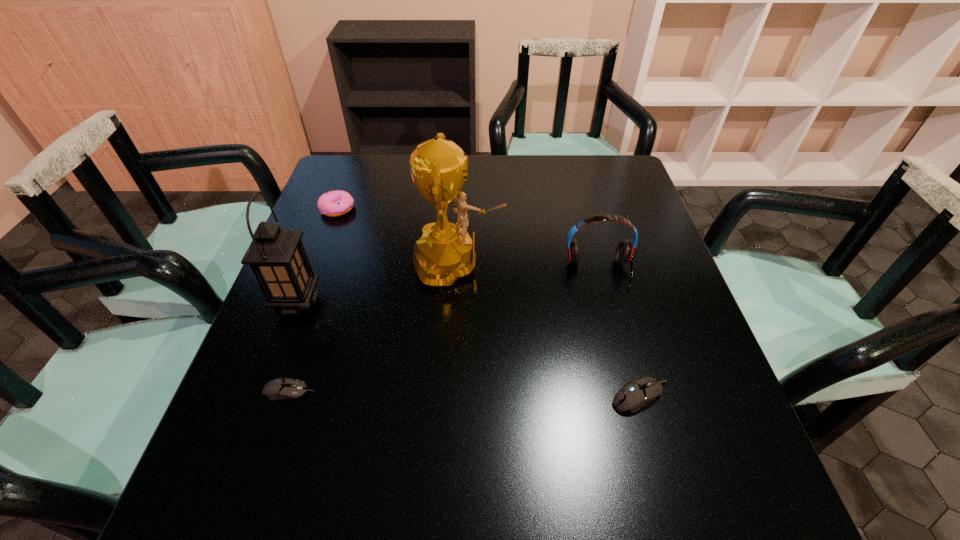
To make them evenly spaced by inserting another mouse_(computer_equipment) among them, please locate a free space for this new mouse_(computer_equipment). Please provide its 2D coordinates. Your answer should be formatted as a tuple, i.e. [(x, y)], where the tuple contains the x and y coordinates of a point satisfying the conditions above.

[(464, 394)]